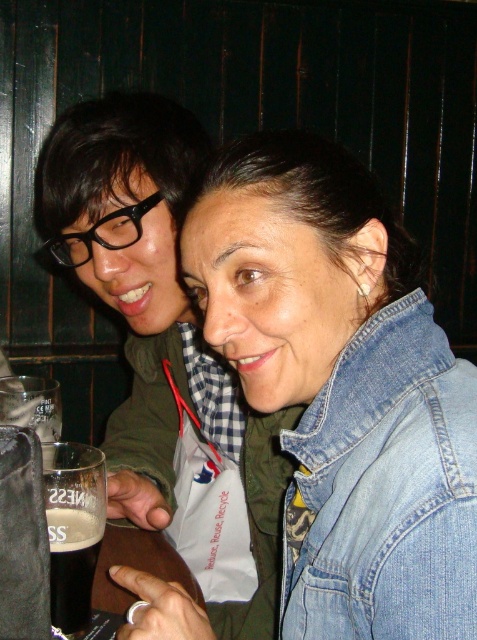
You are a server at the restaurant and need to place a 12 inch wide dessert plate between the denim jacket at lower right and the dark brown glass at lower left. Can you fit it there?

The denim jacket at lower right might be wider than dark brown glass at lower left, so the space between them may not be wide enough to fit a 12 inch dessert plate. Check the actual distance before placing it.

You are a waiter in a restaurant and need to place a 22 cm wide menu between the denim jacket at lower right and the dark brown glass at lower left. Will there be enough space?

The denim jacket at lower right and dark brown glass at lower left are 21.83 centimeters apart, so the 22 cm wide menu will not fit between them.

You are a waiter in a restaurant. You need to deliver a drink to the customer wearing the denim jacket at lower right. The dark brown glass at lower left is already occupied. Where should you place the drink?

The denim jacket at lower right is above the dark brown glass at lower left, so you should place the drink on the table to the right of the dark brown glass at lower left, where the denim jacket at lower right is located.